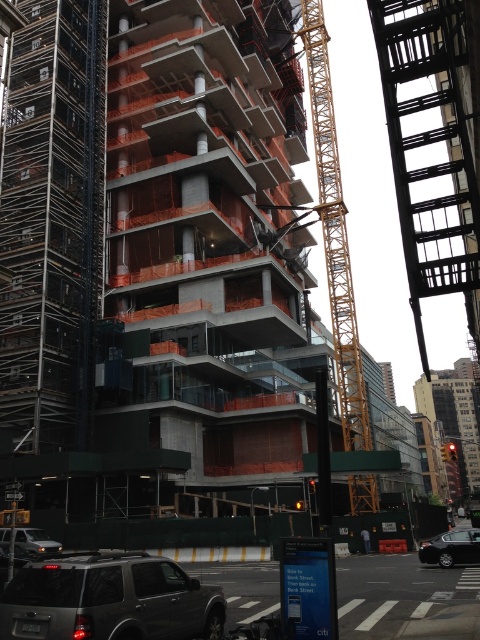
Question: Which point is farther from the camera taking this photo?

Choices:
 (A) (352, 422)
 (B) (128, 554)

Answer: (A)

Question: Does yellow metallic crane at center appear under black fabric construction worker at center?

Choices:
 (A) no
 (B) yes

Answer: (A)

Question: Does matte gray suv at lower left appear over yellow metallic crane at center?

Choices:
 (A) yes
 (B) no

Answer: (B)

Question: Based on their relative distances, which object is nearer to the black fabric construction worker at center?

Choices:
 (A) metallic gray fire escape at upper right
 (B) silver metallic car at lower left
 (C) yellow metallic crane at center
 (D) shiny black sedan at lower right

Answer: (D)

Question: Can you confirm if metallic gray fire escape at upper right is bigger than matte gray suv at lower left?

Choices:
 (A) yes
 (B) no

Answer: (A)

Question: Which of the following is the farthest from the observer?

Choices:
 (A) (417, 316)
 (B) (62, 618)
 (C) (44, 316)
 (D) (467, 557)

Answer: (C)